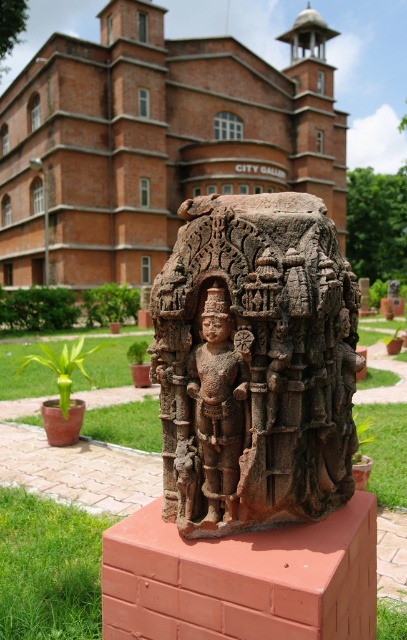
You are standing in front of the large stone sculpture in the outdoor museum. There is a point marked at coordinates (x=255, y=364). What does this point indicate?

The point at coordinates (x=255, y=364) indicates the brown stone statue at center.

You are an art conservator measuring the spacing between two parts of a sculpture. You have a ruler that can measure up to 10 centimeters. You need to check the distance between the brown stone statue at center and the brown stone deity at center. Will your ruler be sufficient?

The brown stone statue at center and brown stone deity at center are 9.84 centimeters apart from each other. Since your ruler can measure up to 10 centimeters, it will be sufficient to measure the distance between them.

You are a visitor at the outdoor museum and want to take a photo of the brown stone statue at center and the brown stone deity at center. Can you see both objects clearly in the same frame without moving your camera?

The brown stone statue at center is in front of the brown stone deity at center, so the statue may block part of the deity in the photo. You might need to adjust your position to ensure both are visible.